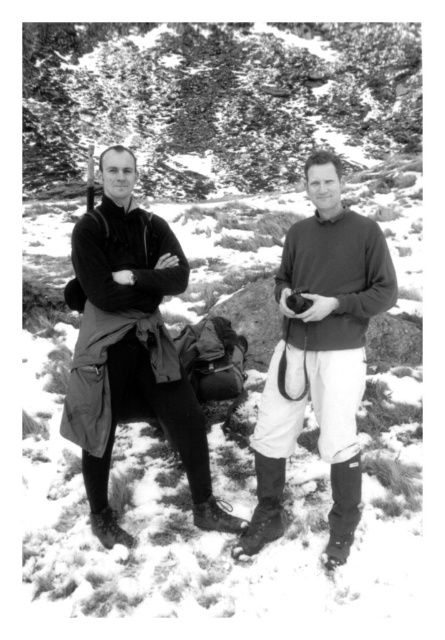
Which of these two, matte black jacket at center or matte brown sweater at center, stands taller?

matte brown sweater at center is taller.

Is matte black jacket at center above matte brown sweater at center?

Yes.

Between point (332, 422) and point (283, 461), which one is positioned in front?

Positioned in front is point (332, 422).

Find the location of `matte black jacket at center`. matte black jacket at center is located at coordinates point(320,355).